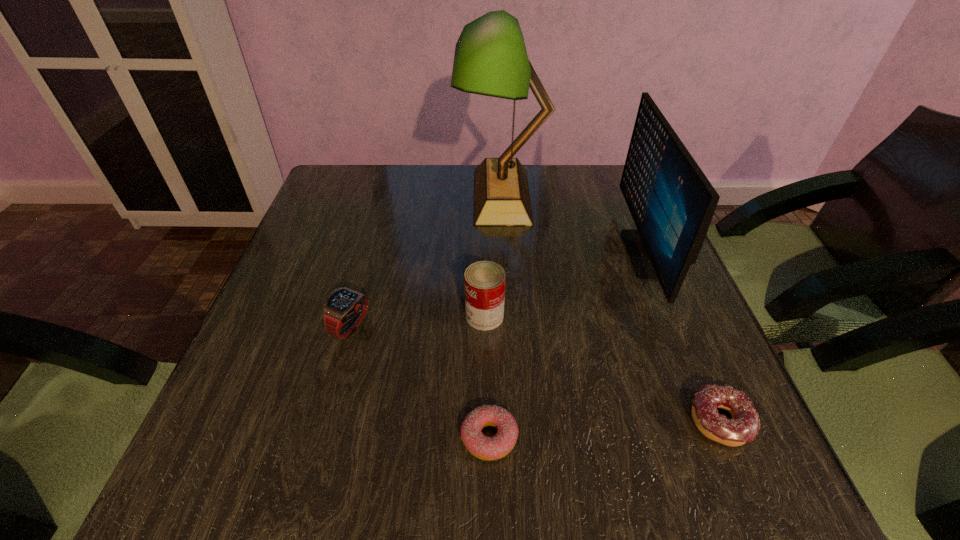
Find the location of `free space located on the left of the shorter doughnut`. free space located on the left of the shorter doughnut is located at coordinates (418, 437).

Locate an element on the screen. Image resolution: width=960 pixels, height=540 pixels. table lamp that is at the far edge is located at coordinates (490, 59).

This screenshot has height=540, width=960. Identify the location of computer monitor at the far edge. (672, 203).

At what (x,y) coordinates should I click in order to perform the action: click on object located in the left edge section of the desktop. Please return your answer as a coordinate pair (x, y). Image resolution: width=960 pixels, height=540 pixels. Looking at the image, I should click on (344, 308).

This screenshot has width=960, height=540. What are the coordinates of `computer monitor that is at the right edge` in the screenshot? It's located at (672, 203).

You are a GUI agent. You are given a task and a screenshot of the screen. Output one action in this format:
    pyautogui.click(x=<x>, y=<y>)
    Task: Click on the doughnut that is positioned at the right edge
    
    Given the screenshot: What is the action you would take?
    pyautogui.click(x=744, y=425)

Where is `object at the far right corner`? The height and width of the screenshot is (540, 960). object at the far right corner is located at coordinates (672, 203).

Image resolution: width=960 pixels, height=540 pixels. Identify the location of object located in the near right corner section of the desktop. 744,425.

The height and width of the screenshot is (540, 960). In order to click on free space at the far edge of the desktop in this screenshot , I will do `click(430, 176)`.

At what (x,y) coordinates should I click in order to perform the action: click on free space at the near edge. Please return your answer as a coordinate pair (x, y). This screenshot has width=960, height=540. Looking at the image, I should click on (432, 487).